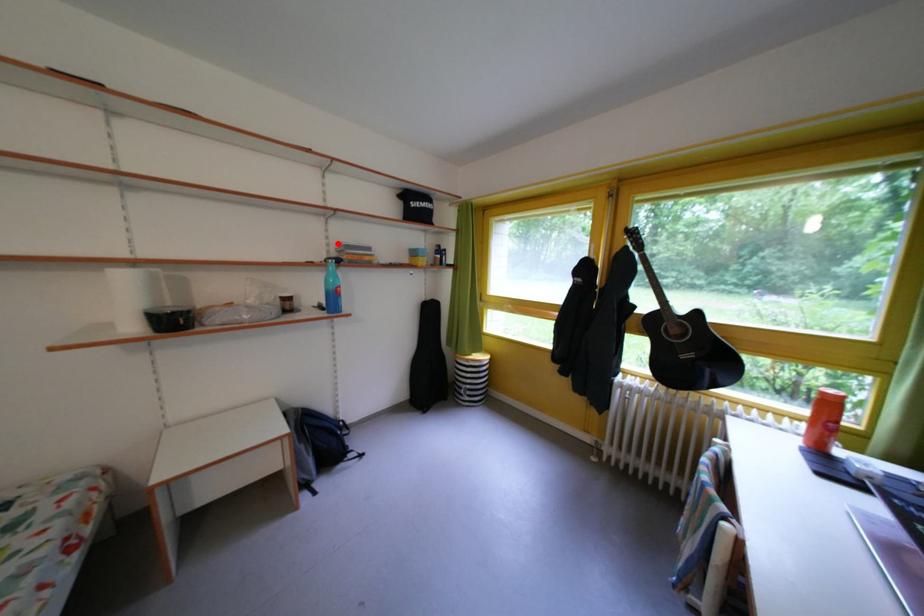
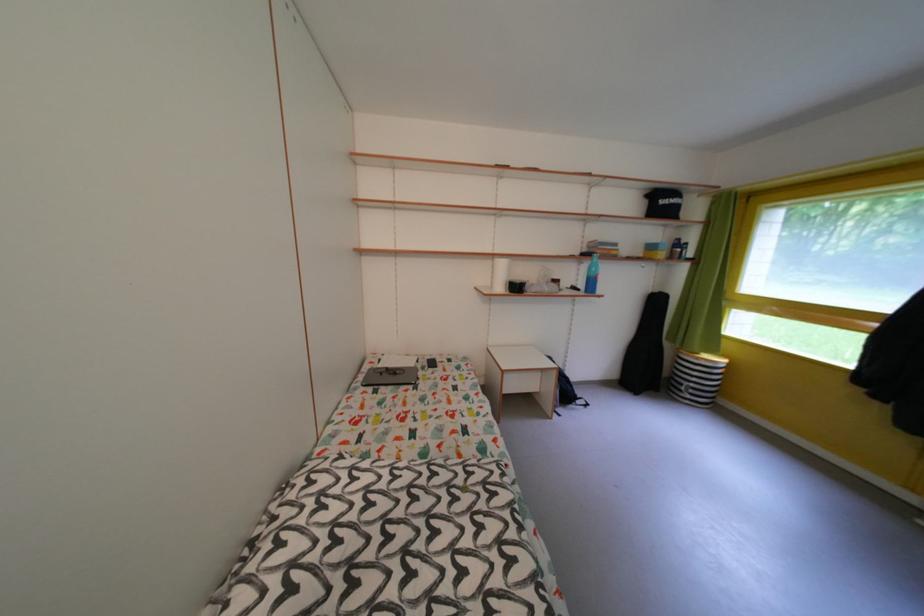
Question: I am providing you with two images of the same scene from different viewpoints. A red point is marked on the first image. Can you still see the location of the red point in image 2?

Choices:
 (A) Yes
 (B) No

Answer: (A)